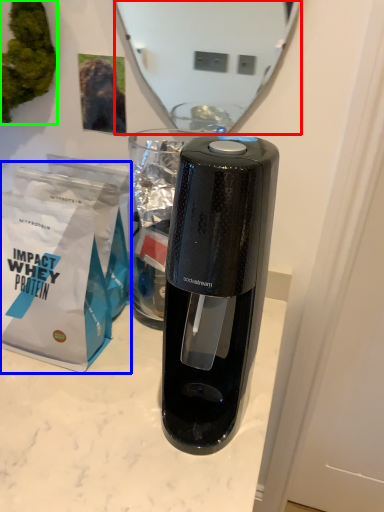
Question: Considering the real-world distances, which object is closest to mirror (highlighted by a red box)? paper bag (highlighted by a blue box) or plant (highlighted by a green box).

Choices:
 (A) paper bag
 (B) plant

Answer: (B)